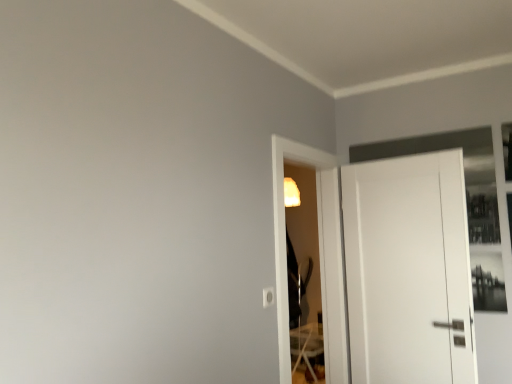
Question: Should I look upward or downward to see transparent glass screen door at center?

Choices:
 (A) up
 (B) down

Answer: (B)

Question: From a real-world perspective, is white matte door at right on transparent glass screen door at center?

Choices:
 (A) yes
 (B) no

Answer: (B)

Question: From a real-world perspective, is white matte door at right beneath transparent glass screen door at center?

Choices:
 (A) yes
 (B) no

Answer: (A)

Question: Considering the relative sizes of white matte door at right and transparent glass screen door at center in the image provided, is white matte door at right bigger than transparent glass screen door at center?

Choices:
 (A) no
 (B) yes

Answer: (A)

Question: From the image's perspective, is white matte door at right below transparent glass screen door at center?

Choices:
 (A) no
 (B) yes

Answer: (B)

Question: Is white matte door at right oriented towards transparent glass screen door at center?

Choices:
 (A) yes
 (B) no

Answer: (A)

Question: Can you confirm if white matte door at right is smaller than transparent glass screen door at center?

Choices:
 (A) yes
 (B) no

Answer: (A)

Question: Is white matte door at right at the back of transparent glass screen door at center?

Choices:
 (A) yes
 (B) no

Answer: (B)

Question: Does transparent glass screen door at center lie in front of white matte door at right?

Choices:
 (A) yes
 (B) no

Answer: (A)

Question: Considering the relative positions of transparent glass screen door at center and white matte door at right in the image provided, is transparent glass screen door at center to the right of white matte door at right from the viewer's perspective?

Choices:
 (A) yes
 (B) no

Answer: (B)

Question: Can you confirm if transparent glass screen door at center is bigger than white matte door at right?

Choices:
 (A) no
 (B) yes

Answer: (B)

Question: Considering the relative sizes of transparent glass screen door at center and white matte door at right in the image provided, is transparent glass screen door at center wider than white matte door at right?

Choices:
 (A) no
 (B) yes

Answer: (B)

Question: Is transparent glass screen door at center far from white matte door at right?

Choices:
 (A) yes
 (B) no

Answer: (B)

Question: From a real-world perspective, is transparent glass screen door at center positioned above or below white matte door at right?

Choices:
 (A) above
 (B) below

Answer: (A)